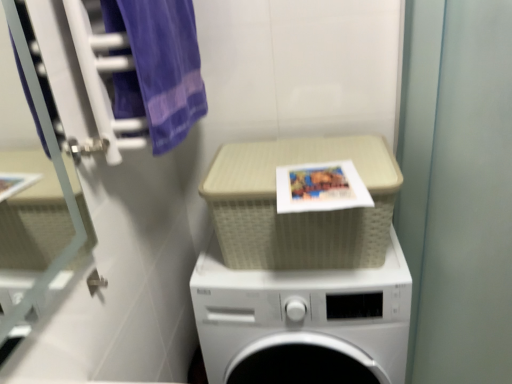
Describe the element at coordinates (458, 189) in the screenshot. This screenshot has width=512, height=384. I see `green matte screen door at right` at that location.

I want to click on purple cotton towel at upper left, so click(158, 67).

Measure the distance between point (x=120, y=21) and camera.

32.52 inches.

I want to click on matte paper book cover at center, so click(320, 187).

Between transparent glass door at left and purple cotton towel at upper left, which one has larger width?

purple cotton towel at upper left.

In the scene shown: Would you say transparent glass door at left is outside purple cotton towel at upper left?

transparent glass door at left is positioned outside purple cotton towel at upper left.

From the image's perspective, would you say transparent glass door at left is shown under purple cotton towel at upper left?

Yes, from the image's perspective, transparent glass door at left is beneath purple cotton towel at upper left.

Is transparent glass door at left turned away from purple cotton towel at upper left?

No, transparent glass door at left's orientation is not away from purple cotton towel at upper left.

From a real-world perspective, does green matte screen door at right sit lower than purple cotton towel at upper left?

Yes, from a real-world perspective, green matte screen door at right is under purple cotton towel at upper left.

Between green matte screen door at right and purple cotton towel at upper left, which one is positioned behind?

purple cotton towel at upper left is behind.

From the image's perspective, is green matte screen door at right positioned above or below purple cotton towel at upper left?

Based on their image positions, green matte screen door at right is located beneath purple cotton towel at upper left.

Does green matte screen door at right have a larger size compared to white plastic washing machine at center?

Indeed, green matte screen door at right has a larger size compared to white plastic washing machine at center.

Could you tell me if green matte screen door at right is turned towards white plastic washing machine at center?

No, green matte screen door at right is not oriented towards white plastic washing machine at center.

Between green matte screen door at right and white plastic washing machine at center, which one has larger width?

With larger width is green matte screen door at right.

In the scene shown: Are purple cotton towel at upper left and transparent glass door at left located far from each other?

No, purple cotton towel at upper left is not far away from transparent glass door at left.

Is purple cotton towel at upper left turned away from transparent glass door at left?

That's not correct — purple cotton towel at upper left is not looking away from transparent glass door at left.

Is purple cotton towel at upper left in front of or behind transparent glass door at left in the image?

Clearly, purple cotton towel at upper left is behind transparent glass door at left.

Is purple cotton towel at upper left bigger than transparent glass door at left?

Correct, purple cotton towel at upper left is larger in size than transparent glass door at left.

Does white plastic washing machine at center turn towards transparent glass door at left?

No, white plastic washing machine at center is not oriented towards transparent glass door at left.

Considering the relative sizes of white plastic washing machine at center and transparent glass door at left in the image provided, is white plastic washing machine at center shorter than transparent glass door at left?

No.

Does white plastic washing machine at center come behind transparent glass door at left?

Yes.

From a real-world perspective, is white plastic washing machine at center under transparent glass door at left?

Yes, from a real-world perspective, white plastic washing machine at center is under transparent glass door at left.

Is white plastic washing machine at center positioned with its back to green matte screen door at right?

No.

Consider the image. Is white plastic washing machine at center taller than green matte screen door at right?

Incorrect, the height of white plastic washing machine at center is not larger of that of green matte screen door at right.

Would you say white plastic washing machine at center is inside or outside green matte screen door at right?

white plastic washing machine at center cannot be found inside green matte screen door at right.

Find the location of a particular element. washing machine lying below the green matte screen door at right (from the image's perspective) is located at coordinates (303, 322).

Consider the image. From a real-world perspective, which is physically above, purple cotton towel at upper left or matte paper book cover at center?

In real-world perspective, purple cotton towel at upper left is above.

Is purple cotton towel at upper left wider or thinner than matte paper book cover at center?

In the image, purple cotton towel at upper left appears to be more narrow than matte paper book cover at center.

How much distance is there between purple cotton towel at upper left and matte paper book cover at center?

A distance of 14.96 inches exists between purple cotton towel at upper left and matte paper book cover at center.

Find the location of `book cover on the right of purple cotton towel at upper left`. book cover on the right of purple cotton towel at upper left is located at coordinates (320, 187).

You are a GUI agent. You are given a task and a screenshot of the screen. Output one action in this format:
    pyautogui.click(x=<x>, y=<y>)
    Task: Click on the bath towel behind the transparent glass door at left
    The image size is (512, 384).
    Given the screenshot: What is the action you would take?
    pyautogui.click(x=158, y=67)

You are a GUI agent. You are given a task and a screenshot of the screen. Output one action in this format:
    pyautogui.click(x=<x>, y=<y>)
    Task: Click on the bath towel above the green matte screen door at right (from the image's perspective)
    The width and height of the screenshot is (512, 384).
    Given the screenshot: What is the action you would take?
    pyautogui.click(x=158, y=67)

Looking at the image, which one is located closer to matte paper book cover at center, white plastic washing machine at center or green matte screen door at right?

green matte screen door at right.

Which object lies further to the anchor point matte paper book cover at center, white plastic washing machine at center or transparent glass door at left?

transparent glass door at left lies further to matte paper book cover at center than the other object.

Based on the photo, estimate the real-world distances between objects in this image. Which object is further from matte paper book cover at center, green matte screen door at right or transparent glass door at left?

transparent glass door at left lies further to matte paper book cover at center than the other object.

From the image, which object appears to be farther from green matte screen door at right, transparent glass door at left or purple cotton towel at upper left?

Based on the image, transparent glass door at left appears to be further to green matte screen door at right.

When comparing their distances from purple cotton towel at upper left, does green matte screen door at right or transparent glass door at left seem further?

The object further to purple cotton towel at upper left is green matte screen door at right.

Which object lies nearer to the anchor point transparent glass door at left, matte paper book cover at center or green matte screen door at right?

matte paper book cover at center lies closer to transparent glass door at left than the other object.

Based on their spatial positions, is transparent glass door at left or white plastic washing machine at center further from matte paper book cover at center?

transparent glass door at left is further to matte paper book cover at center.

From the image, which object appears to be nearer to transparent glass door at left, purple cotton towel at upper left or matte paper book cover at center?

purple cotton towel at upper left is positioned closer to the anchor transparent glass door at left.

Locate an element on the screen. The width and height of the screenshot is (512, 384). glass door between purple cotton towel at upper left and white plastic washing machine at center in the vertical direction is located at coordinates (57, 175).

Where is `book cover that lies between purple cotton towel at upper left and white plastic washing machine at center from top to bottom`? book cover that lies between purple cotton towel at upper left and white plastic washing machine at center from top to bottom is located at coordinates click(x=320, y=187).

This screenshot has height=384, width=512. What are the coordinates of `bath towel positioned between transparent glass door at left and matte paper book cover at center from near to far` in the screenshot? It's located at (158, 67).

Find the location of `book cover between purple cotton towel at upper left and green matte screen door at right`. book cover between purple cotton towel at upper left and green matte screen door at right is located at coordinates (320, 187).